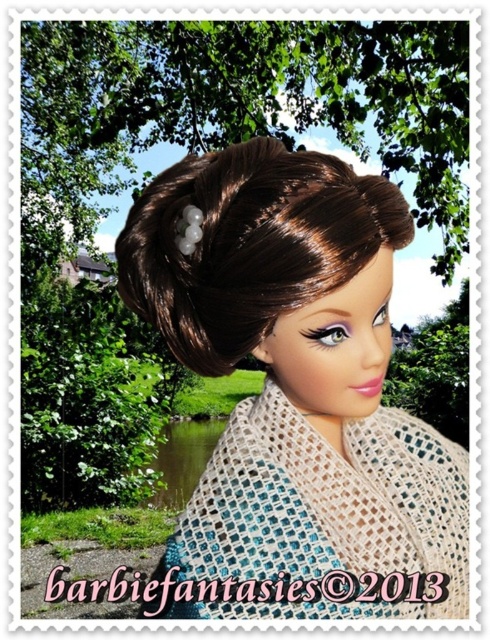
You are a photographer adjusting your camera to focus on the doll in the image. The camera has a focus grid that highlights objects at specific coordinates. Where should you position the focus point to capture the matte brown hair at center?

The matte brown hair at center is located at coordinates point (295, 380), so you should position the focus point there to capture it.

You are a stylist observing the doll and need to adjust her hairstyle. Which object is positioned to the right of the other between the matte brown hair at center and the brown shiny hair bun at center?

The matte brown hair at center is positioned to the right of the brown shiny hair bun at center.

You are a photographer adjusting your camera to focus on the brown shiny hair bun at center. The crochet beige shawl at center is blocking your view. Can you move the shawl closer to the camera to get a clear shot of the hair bun?

The crochet beige shawl at center is already further to the viewer than the brown shiny hair bun at center, so moving it closer would place it even in front of the hair bun, making it more obstructive. To get a clear shot, you should move the shawl away from the camera so it is behind the hair bun.